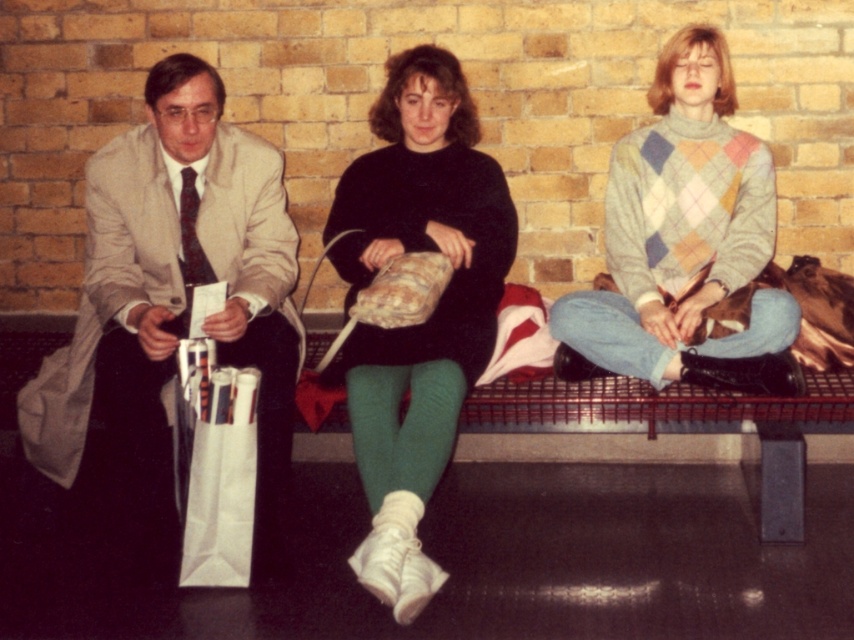
Question: Does black matte sweater at center have a greater width compared to white paper bag at lower left?

Choices:
 (A) yes
 (B) no

Answer: (A)

Question: Does argyle sweater at center come in front of white paper bag at lower left?

Choices:
 (A) no
 (B) yes

Answer: (A)

Question: Among these objects, which one is farthest from the camera?

Choices:
 (A) white paper bag at lower left
 (B) matte beige suit at left

Answer: (B)

Question: Which object is closer to the camera taking this photo?

Choices:
 (A) matte beige suit at left
 (B) white paper bag at lower left

Answer: (B)

Question: Is black matte sweater at center bigger than white paper bag at lower left?

Choices:
 (A) yes
 (B) no

Answer: (A)

Question: Among these objects, which one is farthest from the camera?

Choices:
 (A) black matte sweater at center
 (B) argyle sweater at center
 (C) white paper bag at lower left

Answer: (B)